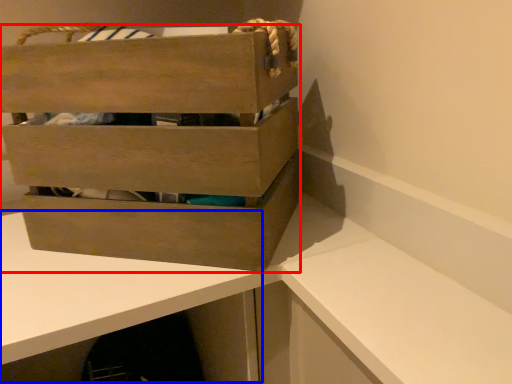
Question: Which object is closer to the camera taking this photo, box (highlighted by a red box) or table (highlighted by a blue box)?

Choices:
 (A) box
 (B) table

Answer: (B)